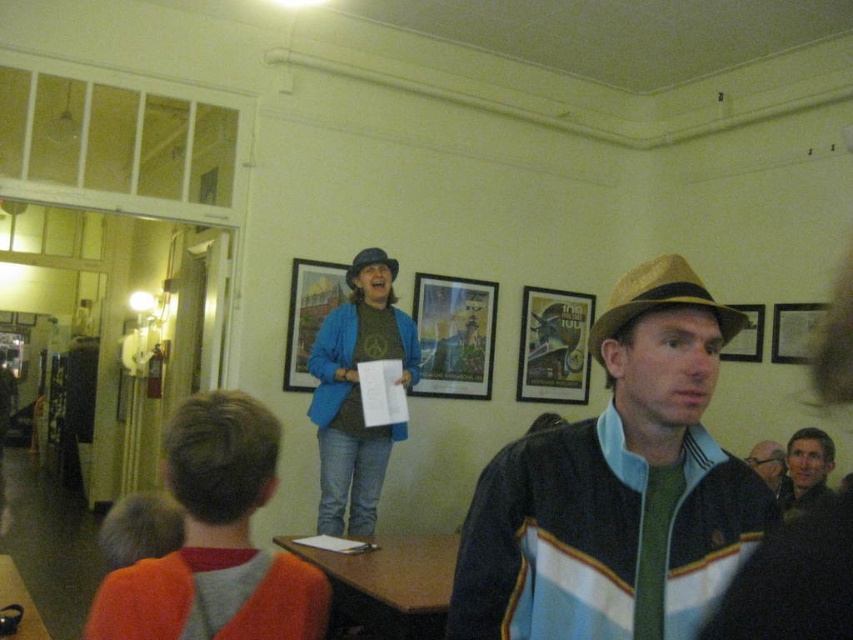
What is located at the coordinates point [215,540]?

The orange sweater at lower left is located at point [215,540].

You are standing in the room and want to pick up both the wooden picture frame at center and the matte blue hat at center. Which object should you reach for first to grab the one closer to you?

The wooden picture frame at center is closer to you than the matte blue hat at center, so you should reach for the wooden picture frame at center first.

You are standing in the room and want to hand a document to both the blue fabric jacket at center and the gold textured cowboy hat at center. Which one should you approach first to reach them in the shortest path?

You should approach the blue fabric jacket at center first because it is closer to you than the gold textured cowboy hat at center, so the shortest path would be to reach the blue fabric jacket at center first.